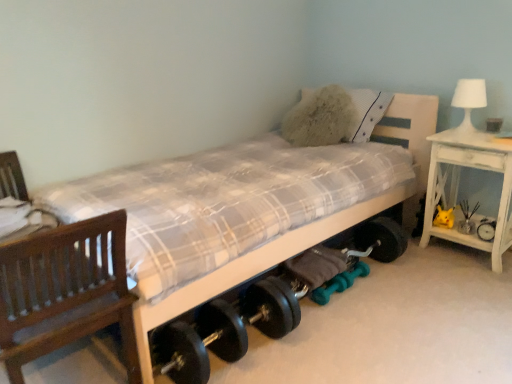
Where is `vacant region in front of teal rubber dumbbell at lower center, the first dumbbell from the right`? The height and width of the screenshot is (384, 512). vacant region in front of teal rubber dumbbell at lower center, the first dumbbell from the right is located at coordinates (365, 302).